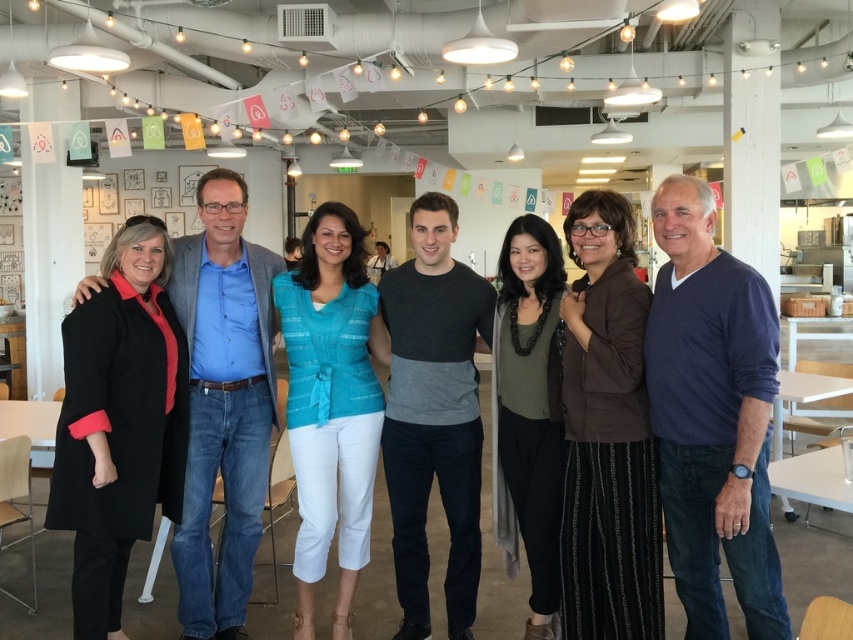
You are standing in the room and want to greet the person wearing the dark blue sweater at right and the person wearing the black cotton shirt at center. Which person should you approach first to be closer to them?

You should approach the person wearing the dark blue sweater at right first because they are closer to you than the black cotton shirt at center.

You are standing in the room and want to grab the black matte coat at left. Based on its position, where should you look to find it?

The black matte coat at left is located at point (223, 403), so you should look to the left side of the room near the lower area to find it.